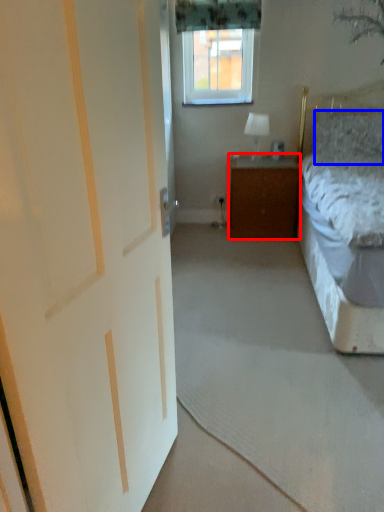
Question: Which object is closer to the camera taking this photo, cabinetry (highlighted by a red box) or pillow (highlighted by a blue box)?

Choices:
 (A) cabinetry
 (B) pillow

Answer: (B)